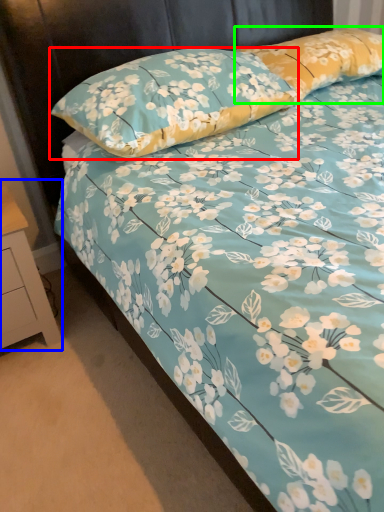
Question: Based on their relative distances, which object is farther from pillow (highlighted by a red box)? Choose from nightstand (highlighted by a blue box) and pillow (highlighted by a green box).

Choices:
 (A) nightstand
 (B) pillow

Answer: (A)